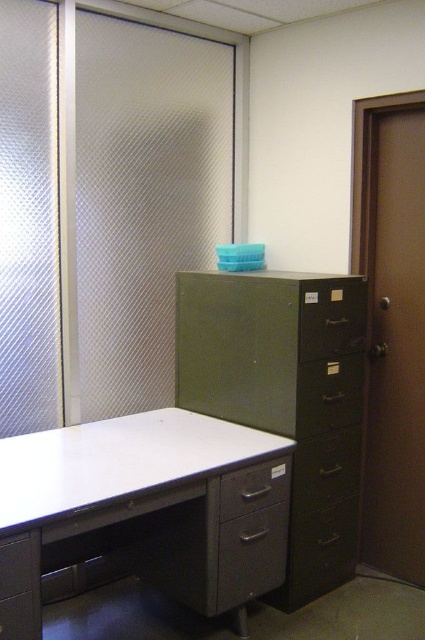
Question: Which of these objects is positioned farthest from the metallic gray drawer at lower center?

Choices:
 (A) matte black drawer at right
 (B) brown matte door at right

Answer: (B)

Question: Is brown matte door at right closer to camera compared to metallic gray drawer at lower center?

Choices:
 (A) yes
 (B) no

Answer: (B)

Question: Is green matte/file cabinet at right positioned at the back of matte black drawer at right?

Choices:
 (A) yes
 (B) no

Answer: (B)

Question: Among these points, which one is nearest to the camera?

Choices:
 (A) (422, 436)
 (B) (263, 506)

Answer: (B)

Question: Considering the real-world distances, which object is farthest from the white matte computer desk at lower left?

Choices:
 (A) matte gray drawer at lower center
 (B) brown matte door at right
 (C) metallic gray drawer at lower center
 (D) green matte/file cabinet at right

Answer: (B)

Question: Observing the image, what is the correct spatial positioning of white matte computer desk at lower left in reference to brown matte door at right?

Choices:
 (A) below
 (B) above

Answer: (A)